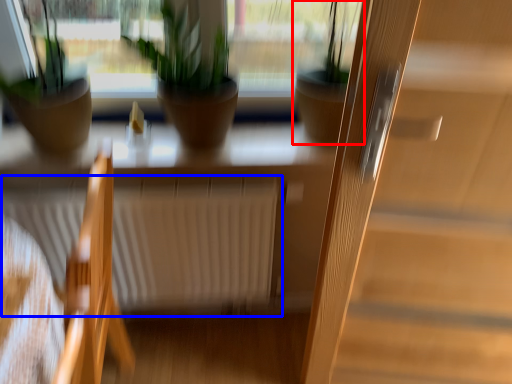
Question: Which point is closer to the camera, houseplant (highlighted by a red box) or radiator (highlighted by a blue box)?

Choices:
 (A) houseplant
 (B) radiator

Answer: (A)